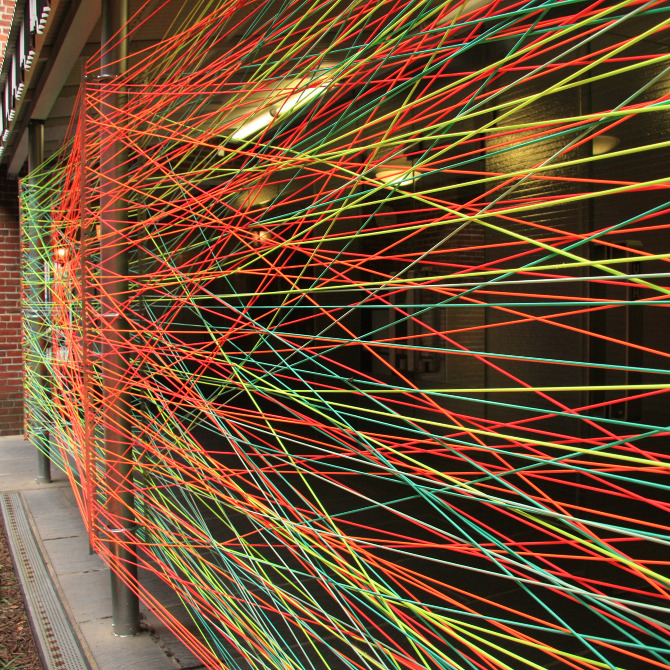
Where is `lights`? This screenshot has height=670, width=670. lights is located at coordinates (304, 98), (258, 129).